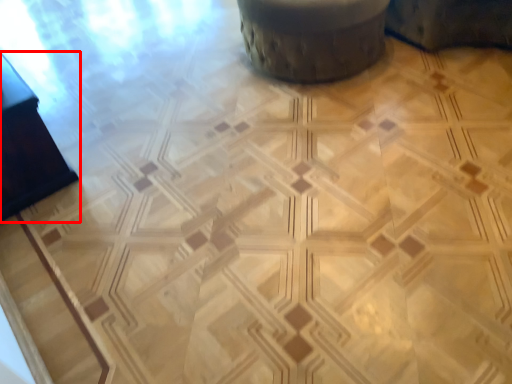
Question: In this image, where is furniture (annotated by the red box) located relative to swivel chair?

Choices:
 (A) left
 (B) right

Answer: (A)